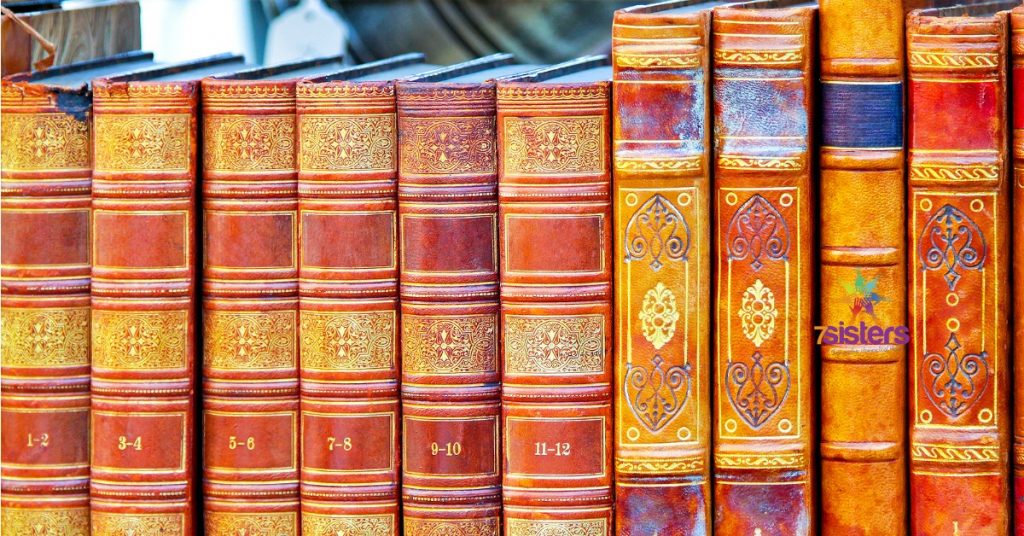
Where is `books`? Image resolution: width=1024 pixels, height=536 pixels. books is located at coordinates (50, 463), (126, 464), (245, 465), (349, 467), (466, 466), (577, 465), (681, 428), (772, 433), (882, 394), (976, 404).